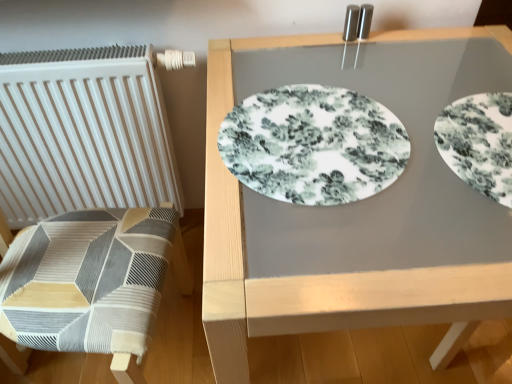
Find the location of a particular element. Image resolution: width=512 pixels, height=384 pixels. vacant area that lies between white floral plate at upper right, marked as the second plate in a left-to-right arrangement, and white floral plate at center, the 1th plate in the left-to-right sequence is located at coordinates (403, 160).